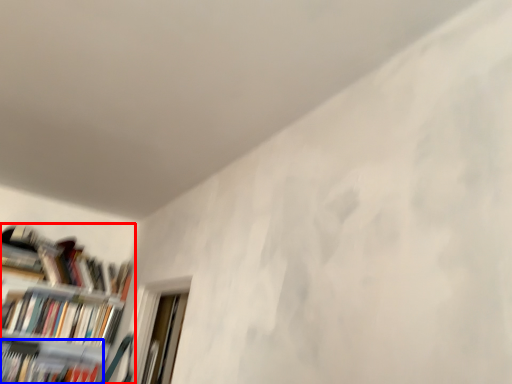
Question: Which of the following is the closest to the observer, bookcase (highlighted by a red box) or book (highlighted by a blue box)?

Choices:
 (A) bookcase
 (B) book

Answer: (A)